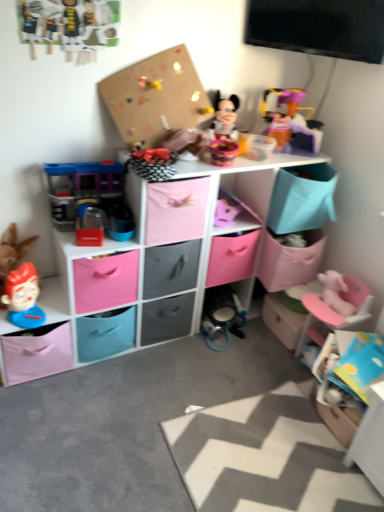
This screenshot has height=512, width=384. What do you see at coordinates (292, 119) in the screenshot? I see `translucent plastic toy at upper right, which is the 1th toy in right-to-left order` at bounding box center [292, 119].

Identify the location of blue cardboard box at lower right, which appears as the third storage box when viewed from the left. The height and width of the screenshot is (512, 384). (347, 380).

Measure the distance between point (71, 177) and camera.

The depth of point (71, 177) is 1.68 meters.

At what (x,y) coordinates should I click in order to perform the action: click on pink fabric storage box at left, arranged as the 1th storage box when viewed from the left. Please return your answer as a coordinate pair (x, y). This screenshot has height=512, width=384. Looking at the image, I should click on (37, 353).

The image size is (384, 512). I want to click on smooth plastic toy head at lower left, the first toy positioned from the left, so click(23, 297).

Locate an element on the screen. pink fabric storage cubes at center is located at coordinates (163, 253).

Is plastic playhouse at left, the second toy when ordered from right to left, far away from blue cardboard box at lower right, which ranks as the first storage box in right-to-left order?

Indeed, plastic playhouse at left, the second toy when ordered from right to left, is not near blue cardboard box at lower right, which ranks as the first storage box in right-to-left order.

Starting from the blue cardboard box at lower right, which appears as the third storage box when viewed from the left, which toy is the 2nd one to the left? Please provide its 2D coordinates.

[(81, 188)]

From the image's perspective, who appears lower, plastic playhouse at left, the 2th toy in the top-to-bottom sequence, or blue cardboard box at lower right, which ranks as the first storage box in right-to-left order?

blue cardboard box at lower right, which ranks as the first storage box in right-to-left order, appears lower in the image.

Can you confirm if plastic playhouse at left, the 2th toy in the top-to-bottom sequence, is shorter than blue cardboard box at lower right, which ranks as the first storage box in right-to-left order?

No.

How different are the orientations of plastic playhouse at left, the 2th toy in the top-to-bottom sequence, and pink fabric storage cubes at center in degrees?

There is a 0.00107-degree angle between the facing directions of plastic playhouse at left, the 2th toy in the top-to-bottom sequence, and pink fabric storage cubes at center.

Considering the positions of points (97, 196) and (151, 256), is point (97, 196) farther from camera compared to point (151, 256)?

No, (97, 196) is closer to viewer.

Is plastic playhouse at left, which is the 2th toy in left-to-right order, in contact with pink fabric storage cubes at center?

There is a gap between plastic playhouse at left, which is the 2th toy in left-to-right order, and pink fabric storage cubes at center.

The image size is (384, 512). What are the coordinates of `shelf located on the right of plastic playhouse at left, the 2th toy in the top-to-bottom sequence` in the screenshot? It's located at (163, 253).

From a real-world perspective, who is located higher, blue cardboard box at lower right, which appears as the third storage box when viewed from the left, or translucent plastic toy at upper right, which ranks as the third toy in left-to-right order?

translucent plastic toy at upper right, which ranks as the third toy in left-to-right order, from a real-world perspective.

Is blue cardboard box at lower right, which ranks as the first storage box in right-to-left order, looking in the opposite direction of translucent plastic toy at upper right, the first toy in the top-to-bottom sequence?

No, blue cardboard box at lower right, which ranks as the first storage box in right-to-left order, is not facing the opposite direction of translucent plastic toy at upper right, the first toy in the top-to-bottom sequence.

Considering the positions of objects blue cardboard box at lower right, which appears as the third storage box when viewed from the left, and translucent plastic toy at upper right, the first toy in the top-to-bottom sequence, in the image provided, who is more to the left, blue cardboard box at lower right, which appears as the third storage box when viewed from the left, or translucent plastic toy at upper right, the first toy in the top-to-bottom sequence,?

Positioned to the left is translucent plastic toy at upper right, the first toy in the top-to-bottom sequence.

Considering the relative sizes of blue cardboard box at lower right, which ranks as the first storage box in right-to-left order, and translucent plastic toy at upper right, arranged as the third toy when ordered from the bottom, in the image provided, is blue cardboard box at lower right, which ranks as the first storage box in right-to-left order, thinner than translucent plastic toy at upper right, arranged as the third toy when ordered from the bottom,?

In fact, blue cardboard box at lower right, which ranks as the first storage box in right-to-left order, might be wider than translucent plastic toy at upper right, arranged as the third toy when ordered from the bottom.

From the image's perspective, would you say blue cardboard box at lower right, which ranks as the first storage box in right-to-left order, is shown under pink plastic swivel chair at lower right?

Yes, from the image's perspective, blue cardboard box at lower right, which ranks as the first storage box in right-to-left order, is beneath pink plastic swivel chair at lower right.

Between blue cardboard box at lower right, which ranks as the first storage box in right-to-left order, and pink plastic swivel chair at lower right, which one is positioned behind?

pink plastic swivel chair at lower right is further from the camera.

Which object is positioned more to the left, blue cardboard box at lower right, which appears as the third storage box when viewed from the left, or pink plastic swivel chair at lower right?

pink plastic swivel chair at lower right is more to the left.

Are blue cardboard box at lower right, which ranks as the first storage box in right-to-left order, and pink plastic swivel chair at lower right making contact?

No, blue cardboard box at lower right, which ranks as the first storage box in right-to-left order, is not beside pink plastic swivel chair at lower right.

From a real-world perspective, is translucent plastic toy at upper right, the first toy in the top-to-bottom sequence, over blue cardboard box at lower right, which appears as the third storage box when viewed from the left?

Yes, from a real-world perspective, translucent plastic toy at upper right, the first toy in the top-to-bottom sequence, is above blue cardboard box at lower right, which appears as the third storage box when viewed from the left.

Are translucent plastic toy at upper right, arranged as the third toy when ordered from the bottom, and blue cardboard box at lower right, which ranks as the first storage box in right-to-left order, located far from each other?

No, translucent plastic toy at upper right, arranged as the third toy when ordered from the bottom, is in close proximity to blue cardboard box at lower right, which ranks as the first storage box in right-to-left order.

From the image's perspective, is translucent plastic toy at upper right, the first toy in the top-to-bottom sequence, beneath blue cardboard box at lower right, which appears as the third storage box when viewed from the left?

Incorrect, from the image's perspective, translucent plastic toy at upper right, the first toy in the top-to-bottom sequence, is higher than blue cardboard box at lower right, which appears as the third storage box when viewed from the left.

Which object is further away from the camera, translucent plastic toy at upper right, the first toy in the top-to-bottom sequence, or blue cardboard box at lower right, which appears as the third storage box when viewed from the left?

Positioned behind is translucent plastic toy at upper right, the first toy in the top-to-bottom sequence.

Is plastic playhouse at left, the 2th toy in the top-to-bottom sequence, positioned far away from pink fabric storage box at left, arranged as the 1th storage box when viewed from the left?

plastic playhouse at left, the 2th toy in the top-to-bottom sequence, is near pink fabric storage box at left, arranged as the 1th storage box when viewed from the left, not far away.

From a real-world perspective, which object stands above the other?

plastic playhouse at left, the 2th toy in the top-to-bottom sequence.

Would you say plastic playhouse at left, the second toy when ordered from right to left, is to the left or to the right of pink fabric storage box at left, which ranks as the 3th storage box in right-to-left order, in the picture?

From the image, it's evident that plastic playhouse at left, the second toy when ordered from right to left, is to the right of pink fabric storage box at left, which ranks as the 3th storage box in right-to-left order.

Does point (73, 180) come behind point (43, 375)?

No, it is in front of (43, 375).

Between plastic playhouse at left, arranged as the second toy when ordered from the bottom, and pink plastic swivel chair at lower right, which one is positioned in front?

plastic playhouse at left, arranged as the second toy when ordered from the bottom.

Considering the relative sizes of plastic playhouse at left, arranged as the second toy when ordered from the bottom, and pink plastic swivel chair at lower right in the image provided, is plastic playhouse at left, arranged as the second toy when ordered from the bottom, thinner than pink plastic swivel chair at lower right?

Indeed, plastic playhouse at left, arranged as the second toy when ordered from the bottom, has a lesser width compared to pink plastic swivel chair at lower right.

From a real-world perspective, starting from the pink plastic swivel chair at lower right, which toy is the 2nd one vertically above it? Please provide its 2D coordinates.

[(81, 188)]

Does plastic playhouse at left, the 2th toy in the top-to-bottom sequence, turn towards pink plastic swivel chair at lower right?

No, plastic playhouse at left, the 2th toy in the top-to-bottom sequence, is not oriented towards pink plastic swivel chair at lower right.

Locate an element on the screen. The height and width of the screenshot is (512, 384). the 1st toy behind when counting from the blue cardboard box at lower right, which ranks as the first storage box in right-to-left order is located at coordinates (81, 188).

From the image's perspective, count 1st toys upward from the pink fabric storage cubes at center and point to it. Please provide its 2D coordinates.

[(81, 188)]

Considering their positions, is smooth plastic toy head at lower left, the 3th toy from the top, positioned further to translucent plastic toy at upper right, the first toy in the top-to-bottom sequence, than blue cardboard box at lower right, which appears as the third storage box when viewed from the left?

Among the two, smooth plastic toy head at lower left, the 3th toy from the top, is located further to translucent plastic toy at upper right, the first toy in the top-to-bottom sequence.

Looking at the image, which one is located further to pink plastic swivel chair at lower right, pink fabric storage box at left, which ranks as the 3th storage box in right-to-left order, or smooth plastic toy head at lower left, the 3th toy from the top?

The object further to pink plastic swivel chair at lower right is smooth plastic toy head at lower left, the 3th toy from the top.

Based on their spatial positions, is translucent plastic toy at upper right, arranged as the third toy when ordered from the bottom, or smooth plastic toy head at lower left, the 1th toy when ordered from bottom to top, closer to blue cardboard box at lower right, which ranks as the first storage box in right-to-left order?

The object closer to blue cardboard box at lower right, which ranks as the first storage box in right-to-left order, is translucent plastic toy at upper right, arranged as the third toy when ordered from the bottom.

Looking at the image, which one is located closer to blue cardboard box at lower right, which appears as the third storage box when viewed from the left, smooth plastic toy head at lower left, the 1th toy when ordered from bottom to top, or pink fabric storage cubes at center?

Among the two, pink fabric storage cubes at center is located nearer to blue cardboard box at lower right, which appears as the third storage box when viewed from the left.

When comparing their distances from wooden toy at lower right, which is the 2th storage box in right-to-left order, does plastic playhouse at left, which is the 2th toy in left-to-right order, or pink plastic swivel chair at lower right seem further?

plastic playhouse at left, which is the 2th toy in left-to-right order, is further to wooden toy at lower right, which is the 2th storage box in right-to-left order.

Which object lies further to the anchor point pink fabric storage cubes at center, pink fabric storage box at left, which ranks as the 3th storage box in right-to-left order, or translucent plastic toy at upper right, which is the 1th toy in right-to-left order?

The object further to pink fabric storage cubes at center is translucent plastic toy at upper right, which is the 1th toy in right-to-left order.

When comparing their distances from pink fabric storage box at left, which ranks as the 3th storage box in right-to-left order, does pink fabric storage cubes at center or wooden toy at lower right, the second storage box viewed from the left, seem further?

wooden toy at lower right, the second storage box viewed from the left, is positioned further to the anchor pink fabric storage box at left, which ranks as the 3th storage box in right-to-left order.

From the image, which object appears to be nearer to wooden toy at lower right, the second storage box viewed from the left, blue cardboard box at lower right, which appears as the third storage box when viewed from the left, or smooth plastic toy head at lower left, the 1th toy when ordered from bottom to top?

The object closer to wooden toy at lower right, the second storage box viewed from the left, is blue cardboard box at lower right, which appears as the third storage box when viewed from the left.

I want to click on storage box between pink fabric storage box at left, which ranks as the 3th storage box in right-to-left order, and blue cardboard box at lower right, which appears as the third storage box when viewed from the left, from left to right, so click(285, 316).

You are a GUI agent. You are given a task and a screenshot of the screen. Output one action in this format:
    pyautogui.click(x=<x>, y=<y>)
    Task: Click on the shelf between smooth plastic toy head at lower left, the 1th toy when ordered from bottom to top, and blue cardboard box at lower right, which ranks as the first storage box in right-to-left order, in the horizontal direction
    The image size is (384, 512).
    Given the screenshot: What is the action you would take?
    pyautogui.click(x=163, y=253)

Identify the location of swivel chair positioned between blue cardboard box at lower right, which ranks as the first storage box in right-to-left order, and wooden toy at lower right, which is the 2th storage box in right-to-left order, from near to far. (335, 311).

Where is `swivel chair located between pink fabric storage cubes at center and blue cardboard box at lower right, which appears as the third storage box when viewed from the left, in the left-right direction`? The image size is (384, 512). swivel chair located between pink fabric storage cubes at center and blue cardboard box at lower right, which appears as the third storage box when viewed from the left, in the left-right direction is located at coordinates (335, 311).